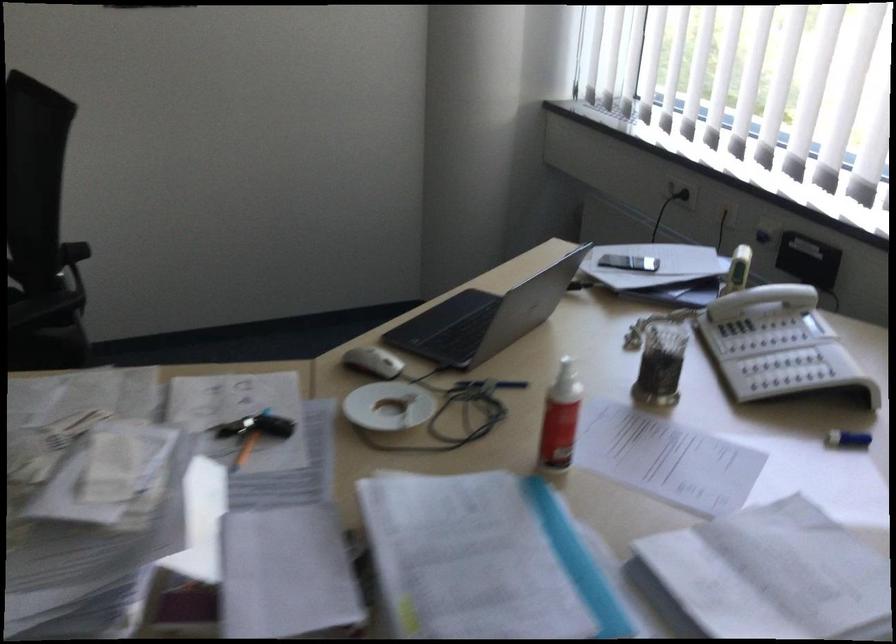
Where is `spray bottle nozzle`? spray bottle nozzle is located at coordinates coord(567,375).